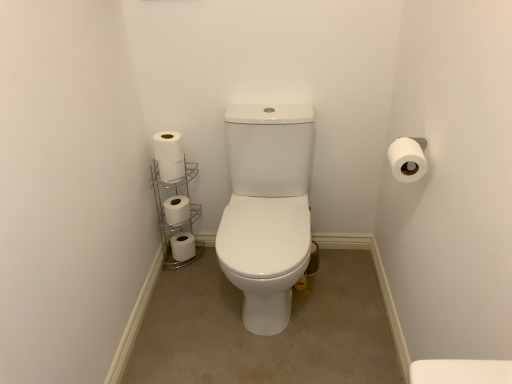
Identify the location of white matte toilet paper at lower left, positioned as the fifth toilet paper in top-to-bottom order. The height and width of the screenshot is (384, 512). (183, 246).

What do you see at coordinates (407, 159) in the screenshot? This screenshot has height=384, width=512. I see `white matte toilet paper at upper right, marked as the fifth toilet paper in a back-to-front arrangement` at bounding box center [407, 159].

This screenshot has height=384, width=512. I want to click on white matte toilet paper at left, placed as the 4th toilet paper when sorted from back to front, so click(x=169, y=156).

Does white metallic toilet paper holder at lower left turn towards white matte toilet paper at upper right, marked as the fifth toilet paper in a back-to-front arrangement?

No, white metallic toilet paper holder at lower left is not turned towards white matte toilet paper at upper right, marked as the fifth toilet paper in a back-to-front arrangement.

At what (x,y) coordinates should I click in order to perform the action: click on shelf that appears on the left of white matte toilet paper at upper right, marked as the 3th toilet paper in a top-to-bottom arrangement. Please return your answer as a coordinate pair (x, y). The width and height of the screenshot is (512, 384). Looking at the image, I should click on (165, 213).

Between white metallic toilet paper holder at lower left and white matte toilet paper at upper right, positioned as the 5th toilet paper in left-to-right order, which one has larger size?

Bigger between the two is white metallic toilet paper holder at lower left.

Considering the relative positions of white metallic toilet paper holder at lower left and white matte toilet paper at upper right, marked as the 3th toilet paper in a top-to-bottom arrangement, in the image provided, is white metallic toilet paper holder at lower left behind white matte toilet paper at upper right, marked as the 3th toilet paper in a top-to-bottom arrangement,?

That is True.

Is white matte toilet paper at center-left, which is the 2th toilet paper from back to front, oriented away from white matte toilet paper at upper right, the first toilet paper in the right-to-left sequence?

No, white matte toilet paper at center-left, which is the 2th toilet paper from back to front,'s orientation is not away from white matte toilet paper at upper right, the first toilet paper in the right-to-left sequence.

Considering the points (176, 221) and (425, 159), which point is in front, point (176, 221) or point (425, 159)?

The point (425, 159) is more forward.

From the image's perspective, is white matte toilet paper at center-left, which ranks as the fourth toilet paper in top-to-bottom order, positioned above or below white matte toilet paper at upper right, which is counted as the 1th toilet paper, starting from the front?

From the image's perspective, white matte toilet paper at center-left, which ranks as the fourth toilet paper in top-to-bottom order, appears below white matte toilet paper at upper right, which is counted as the 1th toilet paper, starting from the front.

Can you confirm if white matte toilet paper at lower left, placed as the 3th toilet paper when sorted from left to right, is thinner than white matte toilet paper at center-left, which appears as the fifth toilet paper when viewed from the right?

Indeed, white matte toilet paper at lower left, placed as the 3th toilet paper when sorted from left to right, has a lesser width compared to white matte toilet paper at center-left, which appears as the fifth toilet paper when viewed from the right.

From a real-world perspective, relative to white matte toilet paper at center-left, marked as the 2th toilet paper in a bottom-to-top arrangement, is white matte toilet paper at lower left, placed as the 3th toilet paper when sorted from left to right, vertically above or below?

white matte toilet paper at lower left, placed as the 3th toilet paper when sorted from left to right, is situated lower than white matte toilet paper at center-left, marked as the 2th toilet paper in a bottom-to-top arrangement, in the real world.

From the picture: Considering the relative positions of white matte toilet paper at lower left, positioned as the fifth toilet paper in top-to-bottom order, and white matte toilet paper at center-left, which is the 2th toilet paper from back to front, in the image provided, is white matte toilet paper at lower left, positioned as the fifth toilet paper in top-to-bottom order, to the right of white matte toilet paper at center-left, which is the 2th toilet paper from back to front, from the viewer's perspective?

Yes.

Is the position of white matte toilet paper at lower left, the fifth toilet paper viewed from the front, more distant than that of white matte toilet paper at center-left, marked as the 1th toilet paper in a left-to-right arrangement?

Yes, the depth of white matte toilet paper at lower left, the fifth toilet paper viewed from the front, is greater than that of white matte toilet paper at center-left, marked as the 1th toilet paper in a left-to-right arrangement.

Is white matte toilet paper at upper right, the third toilet paper ordered from the bottom, to the left of white matte toilet paper at lower left, positioned as the fifth toilet paper in top-to-bottom order, from the viewer's perspective?

In fact, white matte toilet paper at upper right, the third toilet paper ordered from the bottom, is to the right of white matte toilet paper at lower left, positioned as the fifth toilet paper in top-to-bottom order.

Does white matte toilet paper at upper right, the third toilet paper ordered from the bottom, have a greater height compared to white matte toilet paper at lower left, the fifth toilet paper viewed from the front?

Yes, white matte toilet paper at upper right, the third toilet paper ordered from the bottom, is taller than white matte toilet paper at lower left, the fifth toilet paper viewed from the front.

From the image's perspective, is white matte toilet paper at upper right, which is counted as the 1th toilet paper, starting from the front, located above or below white matte toilet paper at lower left, positioned as the fifth toilet paper in top-to-bottom order?

Clearly, from the image's perspective, white matte toilet paper at upper right, which is counted as the 1th toilet paper, starting from the front, is above white matte toilet paper at lower left, positioned as the fifth toilet paper in top-to-bottom order.

Could you tell me if white matte toilet paper at upper right, the first toilet paper in the right-to-left sequence, is facing white matte toilet paper at lower left, the fifth toilet paper viewed from the front?

No.

How far apart are white metallic toilet paper holder at lower left and white matte toilet paper at left, which is the 2th toilet paper from front to back?

white metallic toilet paper holder at lower left and white matte toilet paper at left, which is the 2th toilet paper from front to back, are 8.09 inches apart from each other.

Would you consider white metallic toilet paper holder at lower left to be distant from white matte toilet paper at left, acting as the 4th toilet paper starting from the left?

Actually, white metallic toilet paper holder at lower left and white matte toilet paper at left, acting as the 4th toilet paper starting from the left, are a little close together.

Is point (182, 230) positioned before point (156, 134)?

No, it is behind (156, 134).

Which of these two, white metallic toilet paper holder at lower left or white matte toilet paper at left, placed as the 4th toilet paper when sorted from back to front, is smaller?

white matte toilet paper at left, placed as the 4th toilet paper when sorted from back to front.

Considering the relative positions of white matte toilet paper at left, which is counted as the fifth toilet paper, starting from the bottom, and white matte toilet paper at lower left, the fifth toilet paper viewed from the front, in the image provided, is white matte toilet paper at left, which is counted as the fifth toilet paper, starting from the bottom, to the right of white matte toilet paper at lower left, the fifth toilet paper viewed from the front, from the viewer's perspective?

Yes.

Image resolution: width=512 pixels, height=384 pixels. In order to click on the 1st toilet paper counting from the left of the white matte toilet paper at left, which is the 2th toilet paper from front to back in this screenshot , I will do `click(183, 246)`.

Looking at this image, choose the correct answer: Is white matte toilet paper at left, arranged as the second toilet paper when viewed from the right, inside white matte toilet paper at lower left, the fifth toilet paper viewed from the front, or outside it?

white matte toilet paper at left, arranged as the second toilet paper when viewed from the right, exists outside the volume of white matte toilet paper at lower left, the fifth toilet paper viewed from the front.

Does white matte toilet paper at left, which ranks as the first toilet paper in top-to-bottom order, have a lesser width compared to white matte toilet paper at lower left, the first toilet paper viewed from the back?

Correct, the width of white matte toilet paper at left, which ranks as the first toilet paper in top-to-bottom order, is less than that of white matte toilet paper at lower left, the first toilet paper viewed from the back.

Based on their sizes in the image, would you say white matte toilet paper at upper right, the first toilet paper in the right-to-left sequence, is bigger or smaller than white matte toilet paper at left, which is the 2th toilet paper in left-to-right order?

Clearly, white matte toilet paper at upper right, the first toilet paper in the right-to-left sequence, is larger in size than white matte toilet paper at left, which is the 2th toilet paper in left-to-right order.

Image resolution: width=512 pixels, height=384 pixels. Find the location of `the 3rd toilet paper counting from the left of the white matte toilet paper at upper right, which is counted as the 1th toilet paper, starting from the front`. the 3rd toilet paper counting from the left of the white matte toilet paper at upper right, which is counted as the 1th toilet paper, starting from the front is located at coordinates (170, 171).

Considering the positions of point (410, 172) and point (180, 180), is point (410, 172) closer or farther from the camera than point (180, 180)?

Point (410, 172) is closer to the camera than point (180, 180).

Where is `shelf located on the left of white matte toilet paper at upper right, the third toilet paper ordered from the bottom`? shelf located on the left of white matte toilet paper at upper right, the third toilet paper ordered from the bottom is located at coordinates (165, 213).

Where is `toilet paper that is the 3rd object located in front of the white matte toilet paper at center-left, marked as the 2th toilet paper in a bottom-to-top arrangement`? Image resolution: width=512 pixels, height=384 pixels. toilet paper that is the 3rd object located in front of the white matte toilet paper at center-left, marked as the 2th toilet paper in a bottom-to-top arrangement is located at coordinates (407, 159).

Which object lies further to the anchor point white metallic toilet paper holder at lower left, white matte toilet paper at center-left, which ranks as the fourth toilet paper in top-to-bottom order, or white matte toilet paper at left, which ranks as the fourth toilet paper in right-to-left order?

Among the two, white matte toilet paper at left, which ranks as the fourth toilet paper in right-to-left order, is located further to white metallic toilet paper holder at lower left.

Based on their spatial positions, is white matte toilet paper at center-left, which ranks as the fourth toilet paper in top-to-bottom order, or white matte toilet paper at left, which is counted as the fifth toilet paper, starting from the bottom, closer to white matte toilet paper at upper right, marked as the 3th toilet paper in a top-to-bottom arrangement?

Based on the image, white matte toilet paper at left, which is counted as the fifth toilet paper, starting from the bottom, appears to be nearer to white matte toilet paper at upper right, marked as the 3th toilet paper in a top-to-bottom arrangement.

Based on their spatial positions, is white matte toilet paper at left, which is the 2th toilet paper from front to back, or white matte toilet paper at left, acting as the third toilet paper starting from the back, further from white matte toilet paper at lower left, the fifth toilet paper viewed from the front?

white matte toilet paper at left, which is the 2th toilet paper from front to back.

Considering their positions, is white metallic toilet paper holder at lower left positioned further to white matte toilet paper at lower left, placed as the 3th toilet paper when sorted from left to right, than white matte toilet paper at upper right, marked as the fifth toilet paper in a back-to-front arrangement?

white matte toilet paper at upper right, marked as the fifth toilet paper in a back-to-front arrangement.

When comparing their distances from white matte toilet paper at lower left, arranged as the 1th toilet paper when ordered from the bottom, does white matte toilet paper at center-left, which ranks as the fourth toilet paper in top-to-bottom order, or white metallic toilet paper holder at lower left seem further?

The object further to white matte toilet paper at lower left, arranged as the 1th toilet paper when ordered from the bottom, is white matte toilet paper at center-left, which ranks as the fourth toilet paper in top-to-bottom order.

Looking at the image, which one is located closer to white matte toilet paper at center-left, positioned as the 4th toilet paper in front-to-back order, white matte toilet paper at left, which is the 2th toilet paper from front to back, or white matte toilet paper at lower left, the first toilet paper viewed from the back?

Based on the image, white matte toilet paper at lower left, the first toilet paper viewed from the back, appears to be nearer to white matte toilet paper at center-left, positioned as the 4th toilet paper in front-to-back order.

When comparing their distances from white matte toilet paper at left, the 2th toilet paper when ordered from top to bottom, does white matte toilet paper at lower left, the fifth toilet paper viewed from the front, or white metallic toilet paper holder at lower left seem further?

white matte toilet paper at lower left, the fifth toilet paper viewed from the front, lies further to white matte toilet paper at left, the 2th toilet paper when ordered from top to bottom, than the other object.

Looking at the image, which one is located closer to white matte toilet paper at upper right, marked as the fifth toilet paper in a back-to-front arrangement, white matte toilet paper at center-left, which is the 2th toilet paper from back to front, or white metallic toilet paper holder at lower left?

white metallic toilet paper holder at lower left is positioned closer to the anchor white matte toilet paper at upper right, marked as the fifth toilet paper in a back-to-front arrangement.

Locate an element on the screen. This screenshot has height=384, width=512. shelf between white matte toilet paper at lower left, positioned as the fifth toilet paper in top-to-bottom order, and white matte toilet paper at upper right, positioned as the 5th toilet paper in left-to-right order, from left to right is located at coordinates (165, 213).

I want to click on shelf situated between white matte toilet paper at left, which ranks as the fourth toilet paper in right-to-left order, and white matte toilet paper at upper right, the first toilet paper in the right-to-left sequence, from left to right, so click(x=165, y=213).

Where is `toilet paper between white matte toilet paper at lower left, positioned as the fifth toilet paper in top-to-bottom order, and white matte toilet paper at upper right, positioned as the 5th toilet paper in left-to-right order`? The width and height of the screenshot is (512, 384). toilet paper between white matte toilet paper at lower left, positioned as the fifth toilet paper in top-to-bottom order, and white matte toilet paper at upper right, positioned as the 5th toilet paper in left-to-right order is located at coordinates tap(169, 156).

I want to click on toilet paper between white metallic toilet paper holder at lower left and white matte toilet paper at upper right, marked as the 3th toilet paper in a top-to-bottom arrangement, from left to right, so click(169, 156).